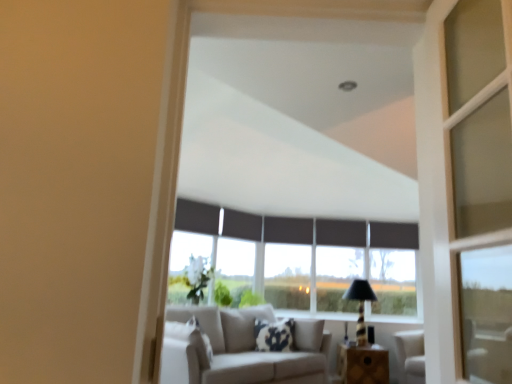
Question: Is black fabric curtain at center, placed as the second curtain when sorted from right to left, in front of or behind wooden table at lower center in the image?

Choices:
 (A) behind
 (B) front

Answer: (A)

Question: Is black fabric curtain at center, marked as the 4th curtain in a left-to-right arrangement, situated inside wooden table at lower center or outside?

Choices:
 (A) inside
 (B) outside

Answer: (B)

Question: Which object is the closest to the black textured table lamp at center?

Choices:
 (A) wooden table at lower center
 (B) black fabric curtain at center, the 2th curtain when ordered from left to right
 (C) black fabric curtain at center, the second curtain viewed from the back
 (D) dark gray fabric curtain at center, which appears as the 3th curtain when viewed from the left
 (E) black fabric curtain at upper center, which is counted as the first curtain, starting from the left

Answer: (C)

Question: Estimate the real-world distances between objects in this image. Which object is closer to the wooden table at lower center?

Choices:
 (A) black fabric curtain at center, the second curtain viewed from the back
 (B) black fabric curtain at center, the 2th curtain when ordered from left to right
 (C) dark matte curtain at center, which appears as the fifth curtain when viewed from the left
 (D) dark gray fabric curtain at center, acting as the third curtain starting from the back
 (E) black fabric curtain at upper center, which ranks as the 5th curtain in right-to-left order

Answer: (D)